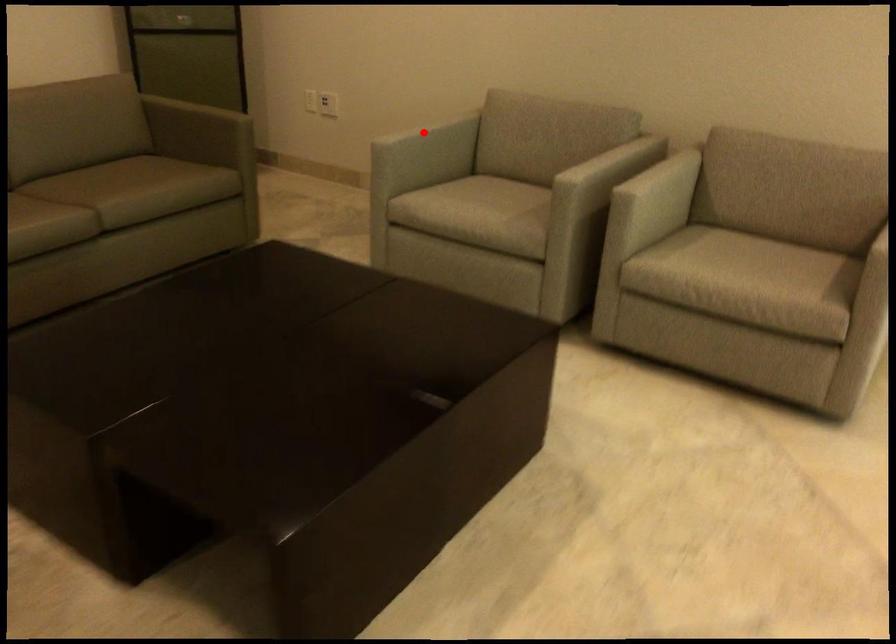
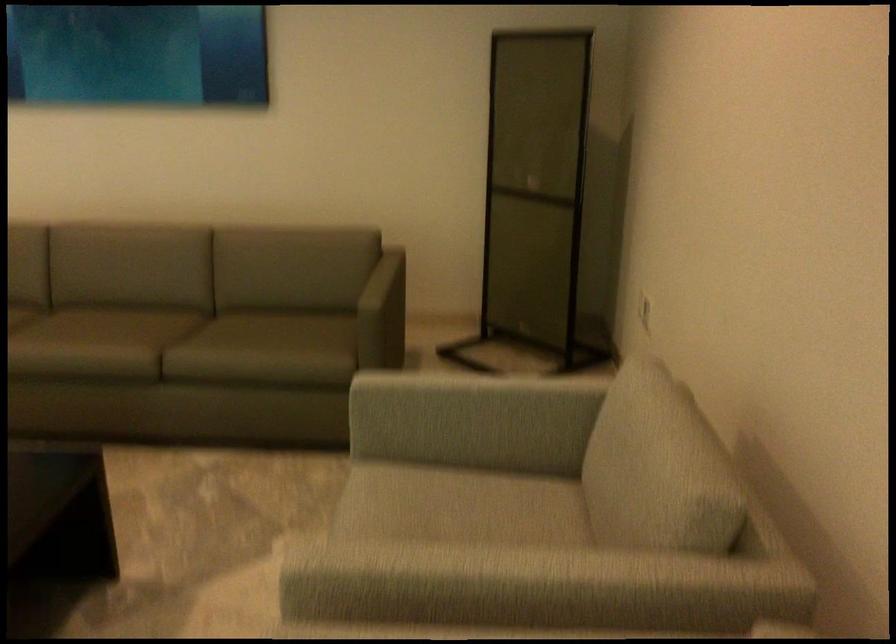
Question: I am providing you with two images of the same scene from different viewpoints. In image1, a red point is highlighted. Considering the same 3D point in image2, which of the following is correct?

Choices:
 (A) It is closer
 (B) It is farther

Answer: (A)